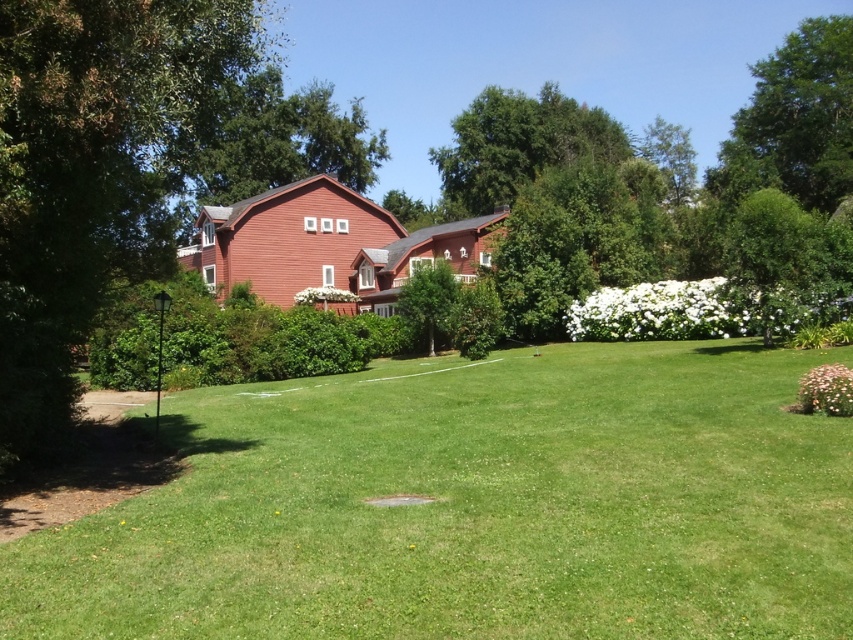
You are standing at the center of the lawn and want to water the green leafy tree at upper right using a hose. Considering the sprinkler system already covers the lawn, which direction should you aim the hose to reach the tree?

The green leafy tree at upper right is located at point (x=793, y=120), so you should aim the hose towards the upper right direction to reach it.

You are standing in front of the house and see the green grassy at center and the green leafy tree at left. Which object is positioned to the right of the other?

The green grassy at center is positioned to the right of the green leafy tree at left.

You are standing in the suburban scene and want to walk from the green leafy tree at left to the green grassy at center. Which direction should you move to reach it?

You should move downward to reach the green grassy at center from the green leafy tree at left because the green grassy at center is below the green leafy tree at left.